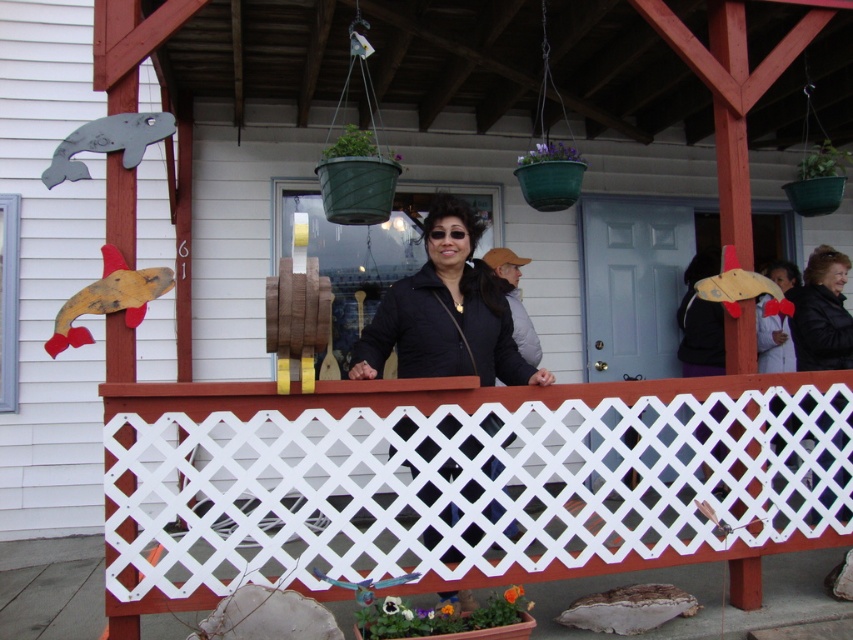
Question: From the image, what is the correct spatial relationship of white lattice at center in relation to black leather jacket at right?

Choices:
 (A) right
 (B) left

Answer: (B)

Question: Among these objects, which one is nearest to the camera?

Choices:
 (A) black matte jacket at center
 (B) white lattice at center
 (C) black leather jacket at right

Answer: (B)

Question: Which point is farther to the camera?

Choices:
 (A) (434, 307)
 (B) (451, 424)

Answer: (B)

Question: Can you confirm if black matte jacket at center is bigger than black leather jacket at right?

Choices:
 (A) no
 (B) yes

Answer: (B)

Question: Which point is closer to the camera taking this photo?

Choices:
 (A) (469, 380)
 (B) (451, 218)
 (C) (791, 337)

Answer: (A)

Question: Does white lattice at center have a larger size compared to black matte jacket at center?

Choices:
 (A) no
 (B) yes

Answer: (B)